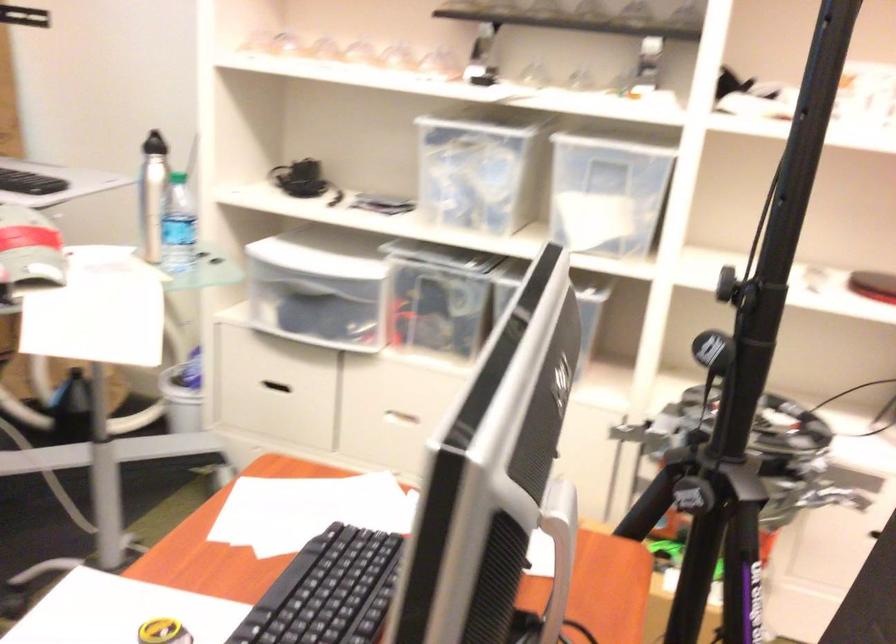
Locate an element on the screen. storage drawer handle is located at coordinates (401, 418).